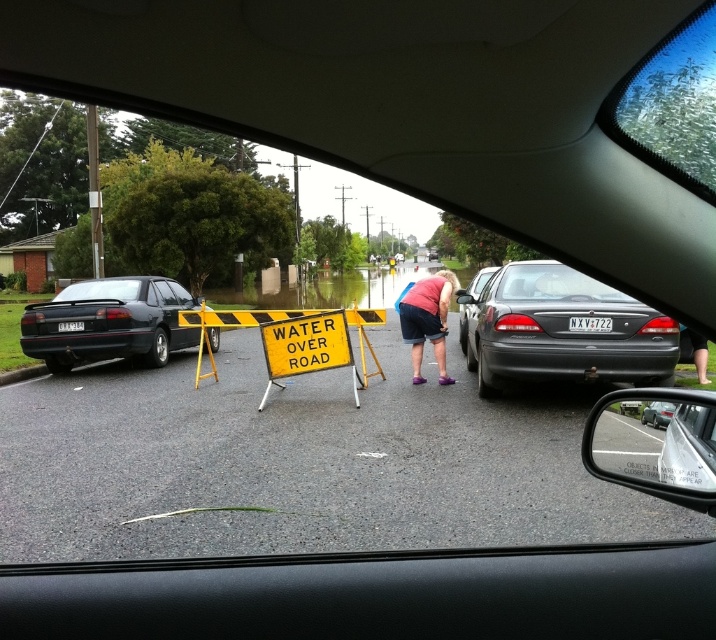
Can you confirm if matte black sedan at left is smaller than matte black sedan at center?

No, matte black sedan at left is not smaller than matte black sedan at center.

Who is more distant from viewer, (x=120, y=301) or (x=654, y=401)?

Positioned behind is point (x=120, y=301).

What do you see at coordinates (107, 323) in the screenshot? The image size is (716, 640). I see `matte black sedan at left` at bounding box center [107, 323].

Where is `matte black sedan at left`? The width and height of the screenshot is (716, 640). matte black sedan at left is located at coordinates (107, 323).

Is point (321, 364) in front of point (657, 406)?

No, it is not.

Who is more forward, (309, 316) or (649, 404)?

Positioned in front is point (649, 404).

This screenshot has height=640, width=716. What are the coordinates of `yellow plastic sign at center` in the screenshot? It's located at (306, 348).

Is matte black sedan at right above pink fabric shirt at center?

Yes, matte black sedan at right is above pink fabric shirt at center.

Where is `matte black sedan at right`? The width and height of the screenshot is (716, 640). matte black sedan at right is located at coordinates (561, 330).

You are a GUI agent. You are given a task and a screenshot of the screen. Output one action in this format:
    pyautogui.click(x=<x>, y=<y>)
    Task: Click on the matte black sedan at right
    
    Given the screenshot: What is the action you would take?
    pyautogui.click(x=561, y=330)